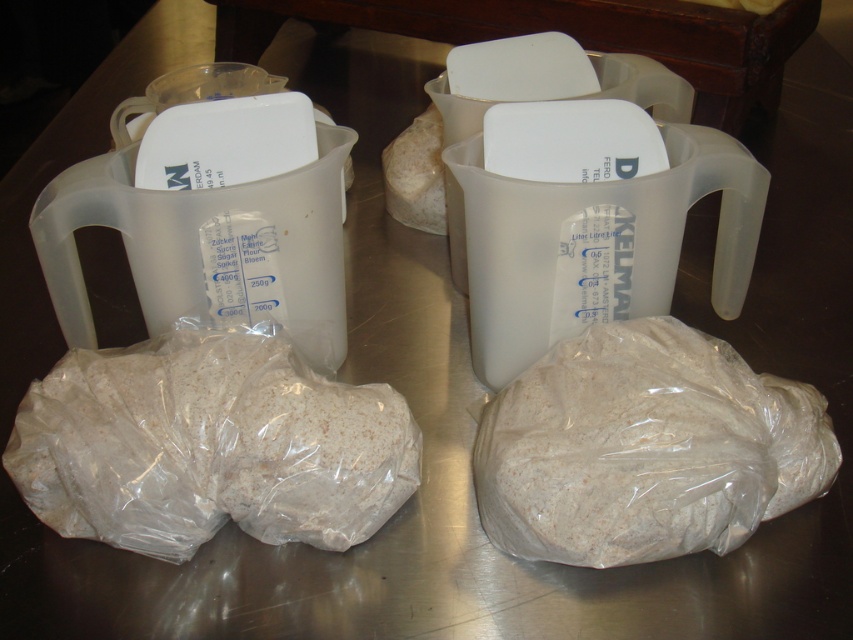
Question: Estimate the real-world distances between objects in this image. Which object is closer to the transparent plastic jug at upper center?

Choices:
 (A) transparent plastic jug at center
 (B) translucent plastic bag at lower left
 (C) transparent plastic jug at left
 (D) translucent plastic bag at lower right

Answer: (A)

Question: Which point is farther to the camera?

Choices:
 (A) (306, 481)
 (B) (428, 90)

Answer: (B)

Question: Which of the following is the closest to the observer?

Choices:
 (A) translucent plastic bag at lower right
 (B) transparent plastic jug at upper center
 (C) translucent plastic bag at lower left
 (D) transparent plastic jug at left

Answer: (A)

Question: Is transparent plastic jug at center bigger than transparent plastic jug at left?

Choices:
 (A) no
 (B) yes

Answer: (B)

Question: Can you confirm if translucent plastic bag at lower left is positioned above transparent plastic jug at center?

Choices:
 (A) no
 (B) yes

Answer: (A)

Question: Does translucent plastic bag at lower left have a larger size compared to transparent plastic jug at center?

Choices:
 (A) no
 (B) yes

Answer: (A)